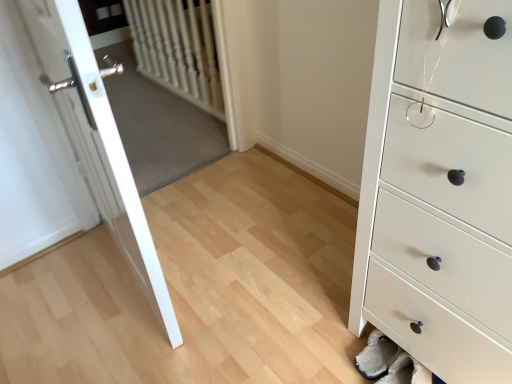
Image resolution: width=512 pixels, height=384 pixels. I want to click on free point below white glossy door at left (from a real-world perspective), so point(134,269).